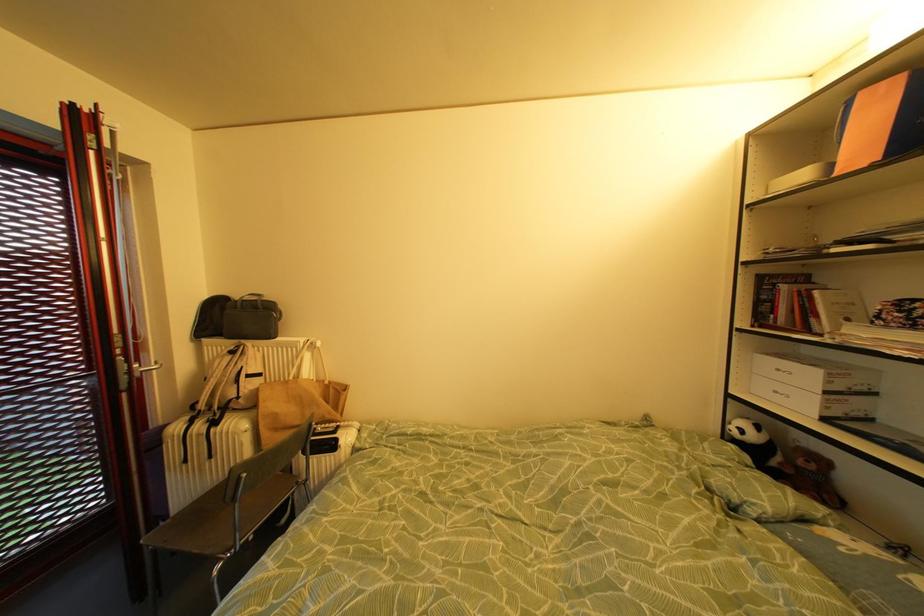
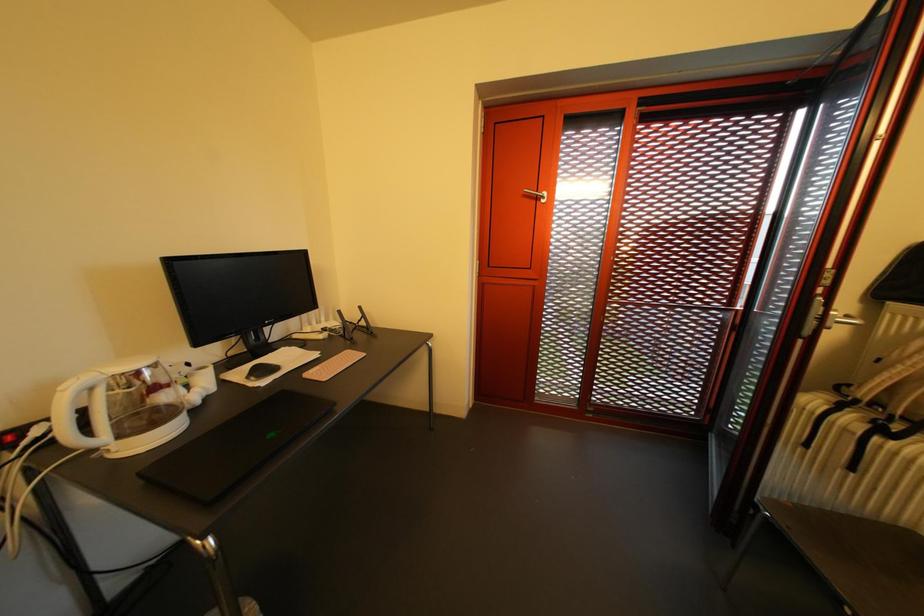
How did the camera likely rotate?

The camera's rotation is toward left-down.